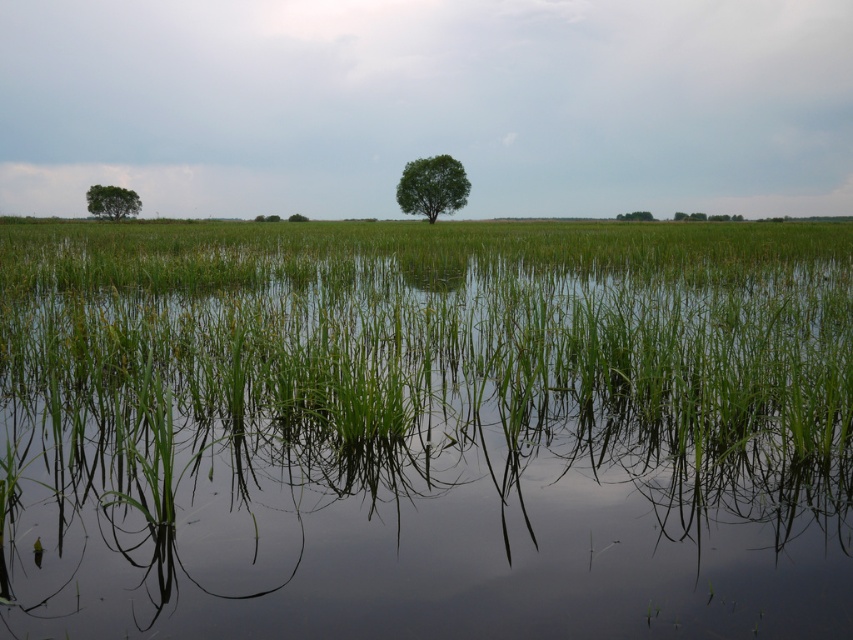
Is green leafy tree at lower left shorter than green leafy tree at upper right?

Incorrect, green leafy tree at lower left's height does not fall short of green leafy tree at upper right's.

Is green leafy tree at lower left positioned behind green leafy tree at upper right?

No, green leafy tree at lower left is closer to the viewer.

Image resolution: width=853 pixels, height=640 pixels. I want to click on green leafy tree at lower left, so click(112, 202).

Is point (633, 216) positioned after point (289, 221)?

Yes, point (633, 216) is farther from viewer.

This screenshot has width=853, height=640. Identify the location of green leafy tree at upper right. (635, 216).

Who is higher up, green leafy tree at center or green leafy tree at upper right?

green leafy tree at center is higher up.

Which of these two, green leafy tree at center or green leafy tree at upper right, stands taller?

With more height is green leafy tree at center.

Does point (434, 195) come farther from viewer compared to point (648, 218)?

That is False.

At what (x,y) coordinates should I click in order to perform the action: click on green leafy tree at center. Please return your answer as a coordinate pair (x, y). This screenshot has height=640, width=853. Looking at the image, I should click on (432, 186).